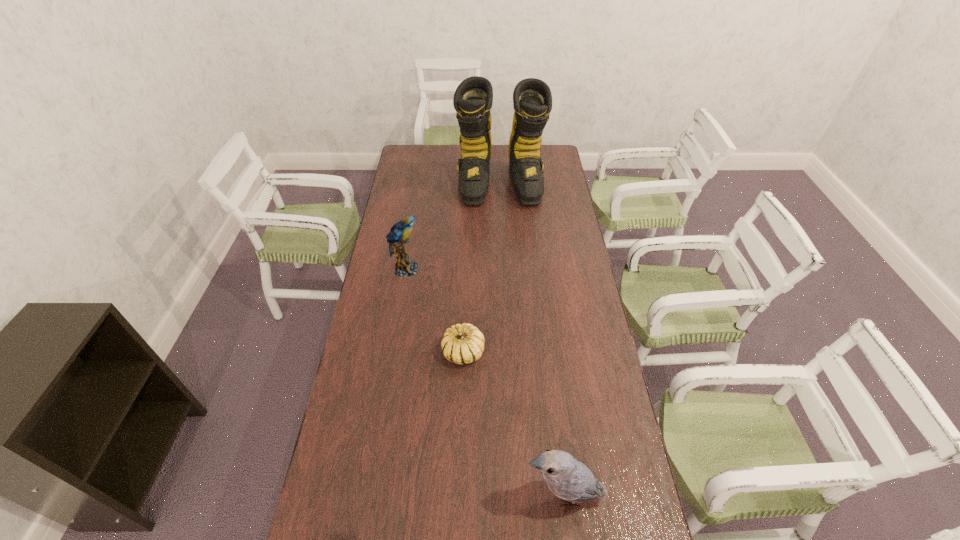
Where is `free point that satisfies the following two spatial constraints: 1. on the face of the shortest object; 2. on the left side of the farther parrot`? The height and width of the screenshot is (540, 960). free point that satisfies the following two spatial constraints: 1. on the face of the shortest object; 2. on the left side of the farther parrot is located at coordinates coord(392,353).